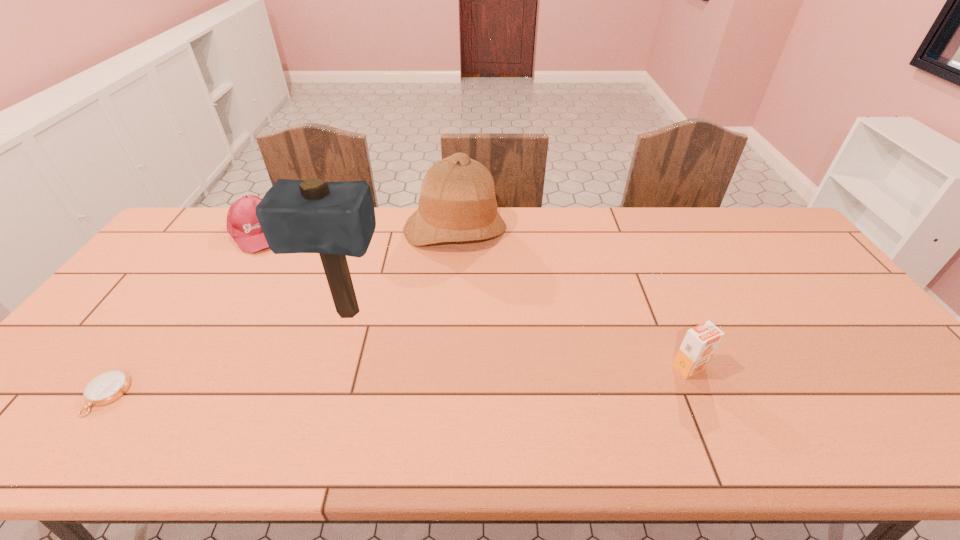
The height and width of the screenshot is (540, 960). I want to click on compass, so click(x=109, y=386).

Find the location of a particular element. The height and width of the screenshot is (540, 960). orange juice is located at coordinates (700, 342).

Where is `the third tallest object`? This screenshot has height=540, width=960. the third tallest object is located at coordinates (700, 342).

Locate an element on the screen. hat is located at coordinates (457, 203).

This screenshot has width=960, height=540. I want to click on the third nearest object, so click(x=335, y=219).

Locate an element on the screen. mallet is located at coordinates (335, 219).

You are a GUI agent. You are given a task and a screenshot of the screen. Output one action in this format:
    pyautogui.click(x=<x>, y=<y>)
    Task: Click on the baseball cap
    
    Given the screenshot: What is the action you would take?
    pyautogui.click(x=242, y=223)

In order to click on vacant area located on the back of the compass in this screenshot , I will do `click(191, 278)`.

Locate an element on the screen. vacant space located on the left of the third tallest object is located at coordinates (648, 368).

Where is `vacant space located 0.400m on the front-facing side of the hat`? This screenshot has height=540, width=960. vacant space located 0.400m on the front-facing side of the hat is located at coordinates (463, 354).